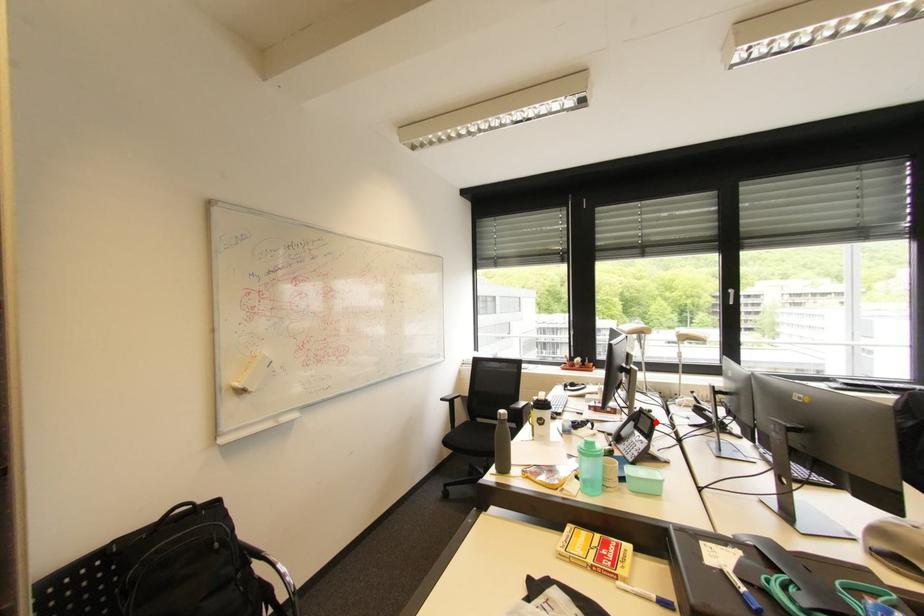
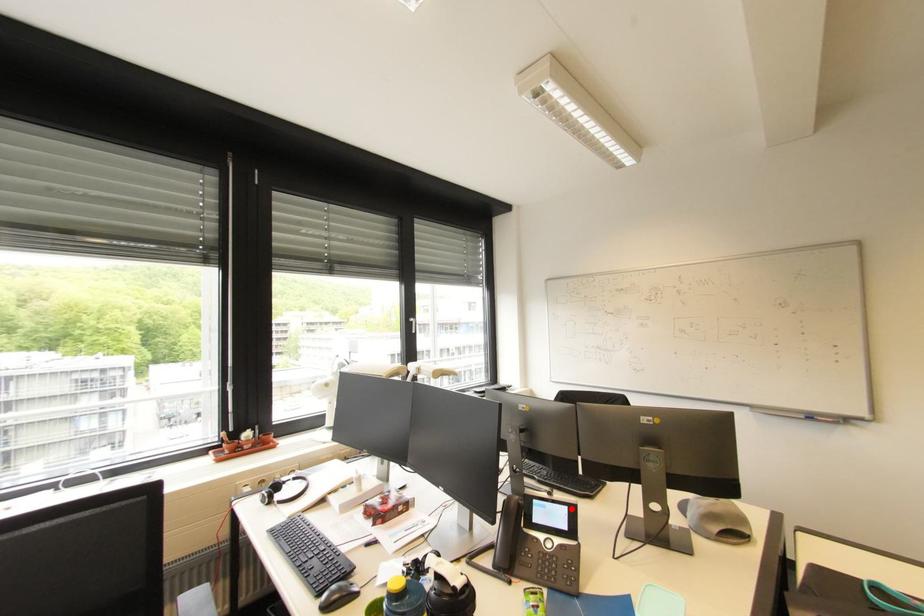
I am providing you with two images of the same scene from different viewpoints. A red point is marked on the first image and another point is marked on the second image. Is the marked point in image1 the same physical position as the marked point in image2?

Yes